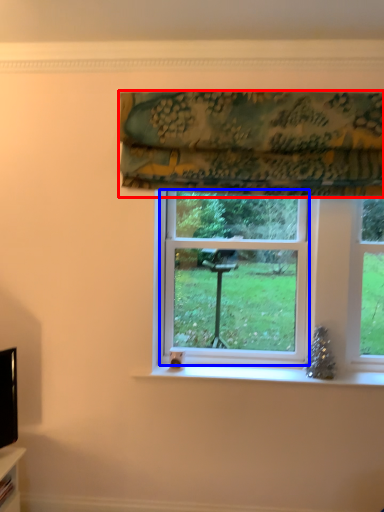
Question: Which point is further to the camera, curtain (highlighted by a red box) or bay window (highlighted by a blue box)?

Choices:
 (A) curtain
 (B) bay window

Answer: (B)